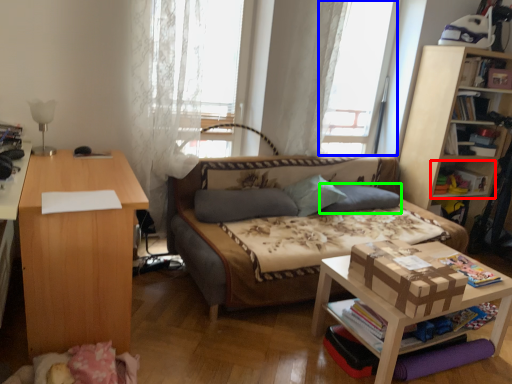
Question: Considering the real-world distances, which object is closest to shelf (highlighted by a red box)? window screen (highlighted by a blue box) or pillow (highlighted by a green box).

Choices:
 (A) window screen
 (B) pillow

Answer: (B)